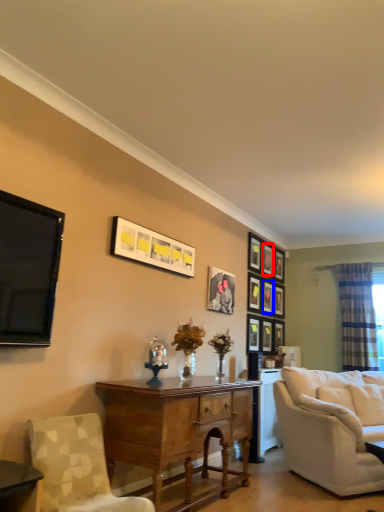
Question: Which object is closer to the camera taking this photo, picture frame (highlighted by a red box) or picture frame (highlighted by a blue box)?

Choices:
 (A) picture frame
 (B) picture frame

Answer: (B)